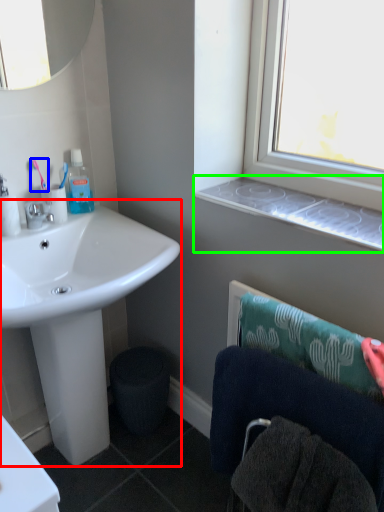
Question: Which object is the closest to the sink (highlighted by a red box)? Choose among these: toothbrush (highlighted by a blue box) or window sill (highlighted by a green box).

Choices:
 (A) toothbrush
 (B) window sill

Answer: (A)